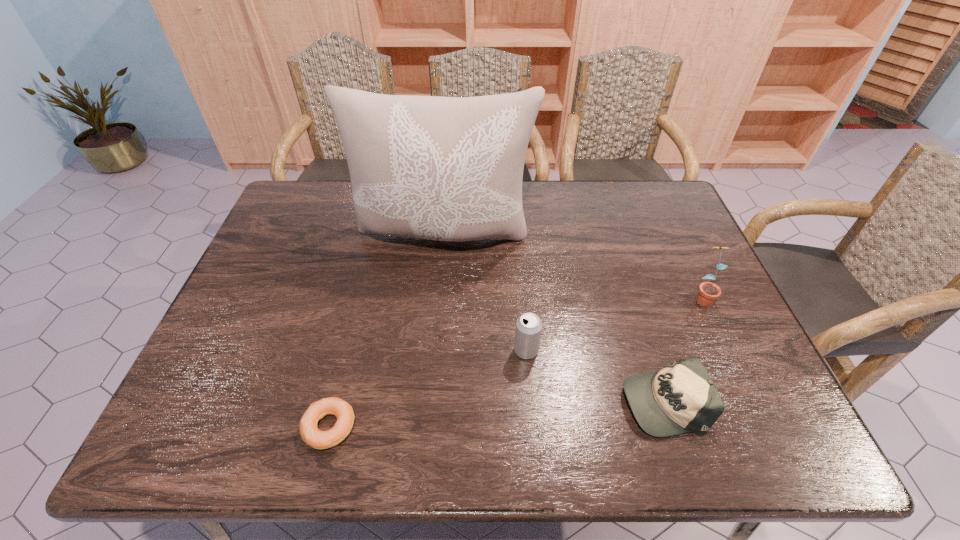
Locate an element on the screen. The width and height of the screenshot is (960, 540). baseball cap located in the right edge section of the desktop is located at coordinates (680, 398).

Where is `object located in the near right corner section of the desktop`? This screenshot has width=960, height=540. object located in the near right corner section of the desktop is located at coordinates (680, 398).

In the image, there is a desktop. Identify the location of vacant area at the far edge. The image size is (960, 540). (336, 215).

I want to click on vacant space at the right edge of the desktop, so click(x=713, y=326).

The width and height of the screenshot is (960, 540). In the image, there is a desktop. Find the location of `vacant space at the far left corner`. vacant space at the far left corner is located at coordinates (328, 195).

This screenshot has width=960, height=540. I want to click on vacant space at the far right corner of the desktop, so click(655, 186).

The width and height of the screenshot is (960, 540). I want to click on free spot between the farthest object and the second tallest object, so click(x=573, y=266).

At what (x,y) coordinates should I click in order to perform the action: click on vacant space that is in between the rightmost object and the beer can. Please return your answer as a coordinate pair (x, y). This screenshot has width=960, height=540. Looking at the image, I should click on (613, 323).

The height and width of the screenshot is (540, 960). Find the location of `vacant space in between the cushion and the second shortest object`. vacant space in between the cushion and the second shortest object is located at coordinates (554, 319).

Where is `vacant space that's between the bagel and the second shortest object`? Image resolution: width=960 pixels, height=540 pixels. vacant space that's between the bagel and the second shortest object is located at coordinates (496, 414).